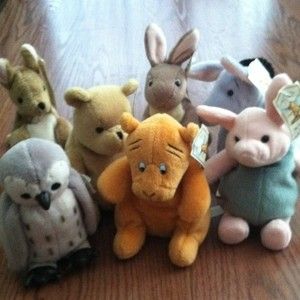
Identify the location of toys. (45, 177), (42, 96), (85, 115), (176, 147), (173, 65), (249, 90), (254, 138).